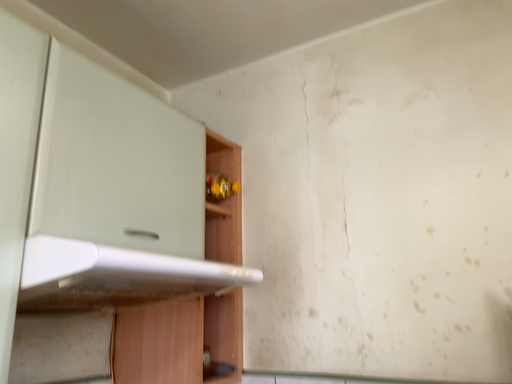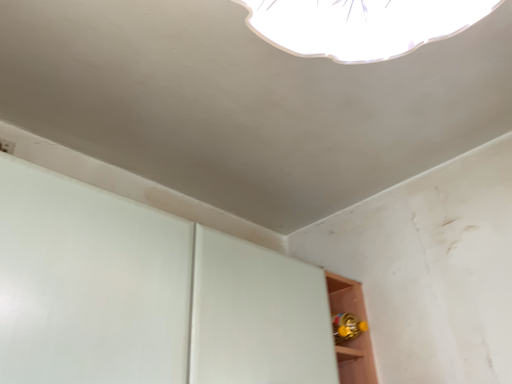
Question: Which way did the camera rotate in the video?

Choices:
 (A) rotated downward
 (B) rotated upward

Answer: (B)